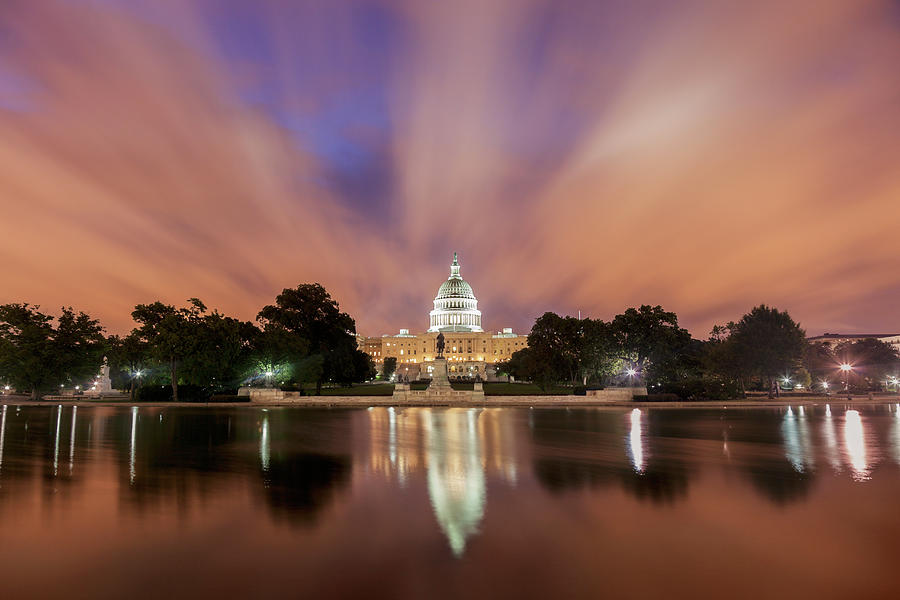
Locate an element on the screen. This screenshot has height=600, width=900. light is located at coordinates (265, 371).